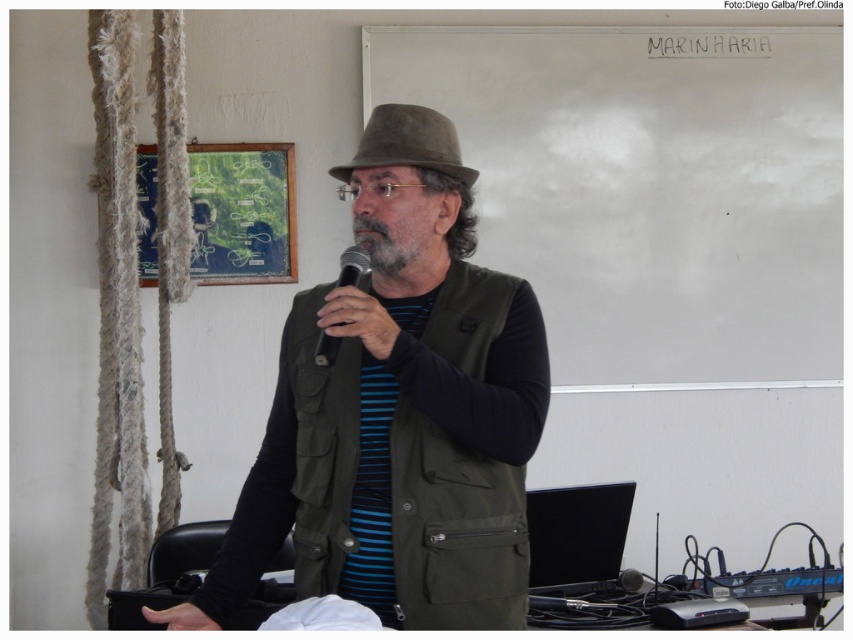
Question: Is gray matte beard at center smaller than black matte microphone at center?

Choices:
 (A) yes
 (B) no

Answer: (A)

Question: Can you confirm if gray matte beard at center is thinner than black matte microphone at center?

Choices:
 (A) yes
 (B) no

Answer: (B)

Question: Based on their relative distances, which object is nearer to the gray matte beard at center?

Choices:
 (A) matte olive green vest at center
 (B) black matte microphone at center
 (C) brown felt fedora at upper center

Answer: (B)

Question: Among these points, which one is farthest from the camera?

Choices:
 (A) (407, 129)
 (B) (430, 284)
 (C) (339, 342)

Answer: (B)

Question: Is gray matte beard at center bigger than black matte microphone at center?

Choices:
 (A) no
 (B) yes

Answer: (A)

Question: Among these points, which one is farthest from the camera?

Choices:
 (A) (294, 435)
 (B) (393, 269)
 (C) (373, 109)
 (D) (364, 259)

Answer: (A)